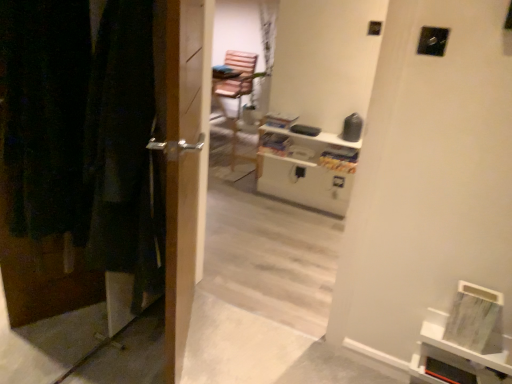
Question: From the image's perspective, does white glossy entertainment center at upper center appear higher than wooden door at left?

Choices:
 (A) no
 (B) yes

Answer: (B)

Question: Is white glossy entertainment center at upper center further to the viewer compared to wooden door at left?

Choices:
 (A) no
 (B) yes

Answer: (B)

Question: Is white glossy entertainment center at upper center far from wooden door at left?

Choices:
 (A) no
 (B) yes

Answer: (B)

Question: From the image's perspective, would you say white glossy entertainment center at upper center is shown under wooden door at left?

Choices:
 (A) yes
 (B) no

Answer: (B)

Question: Is white glossy entertainment center at upper center at the left side of wooden door at left?

Choices:
 (A) yes
 (B) no

Answer: (B)

Question: From a real-world perspective, is white glossy entertainment center at upper center over wooden door at left?

Choices:
 (A) yes
 (B) no

Answer: (B)

Question: Can you confirm if white glossy entertainment center at upper center is positioned to the left of metallic silver handle at left?

Choices:
 (A) no
 (B) yes

Answer: (A)

Question: Is white glossy entertainment center at upper center positioned beyond the bounds of metallic silver handle at left?

Choices:
 (A) yes
 (B) no

Answer: (A)

Question: Does white glossy entertainment center at upper center have a greater width compared to metallic silver handle at left?

Choices:
 (A) no
 (B) yes

Answer: (B)

Question: Is metallic silver handle at left located within white glossy entertainment center at upper center?

Choices:
 (A) yes
 (B) no

Answer: (B)

Question: Is the depth of white glossy entertainment center at upper center less than that of metallic silver handle at left?

Choices:
 (A) yes
 (B) no

Answer: (B)

Question: From the image's perspective, is white glossy entertainment center at upper center located above metallic silver handle at left?

Choices:
 (A) no
 (B) yes

Answer: (B)

Question: Does white matte bookshelf at lower right appear on the left side of wooden door at left?

Choices:
 (A) no
 (B) yes

Answer: (A)